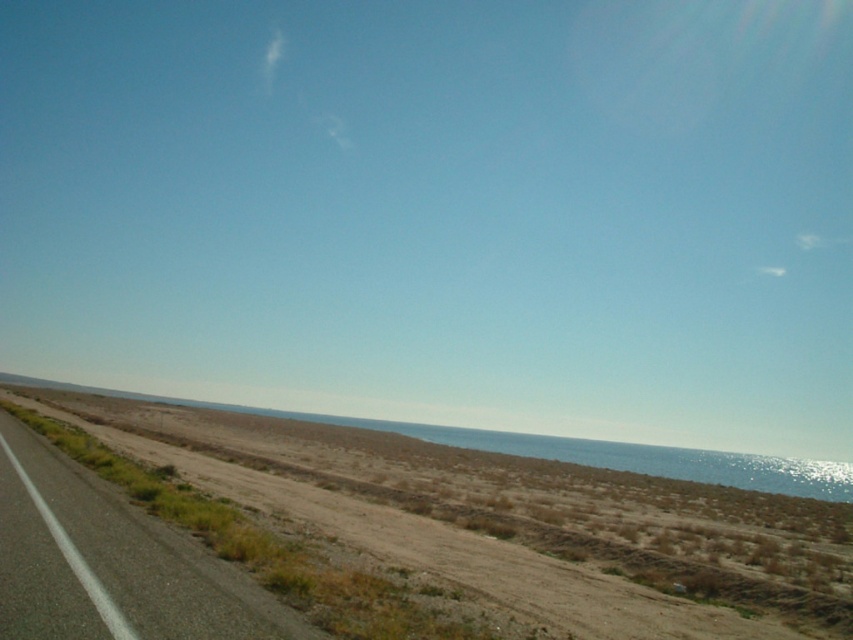
You are driving a car and want to avoid the asphalt road at left. Which direction should you steer your car to move towards the brown sandy desert at lower left?

The brown sandy desert at lower left is positioned on the right side of asphalt road at left, so you should steer your car to the right to move towards it.

You are standing at the origin point of the coordinate system in this image. You want to walk towards the brown sandy desert at lower left. Which direction should you face to head straight towards it?

You should face the direction corresponding to the coordinates of the brown sandy desert at lower left, which is at point 0.800 on the x axis and 0.606 on the y axis. Since lower left in the image typically corresponds to lower x and y values, but the coordinates here might be normalized. However, based on the given coordinates, the exact direction would require knowing the coordinate system orientation. But since the question is about facing the direction of the object, the answer should state that you can